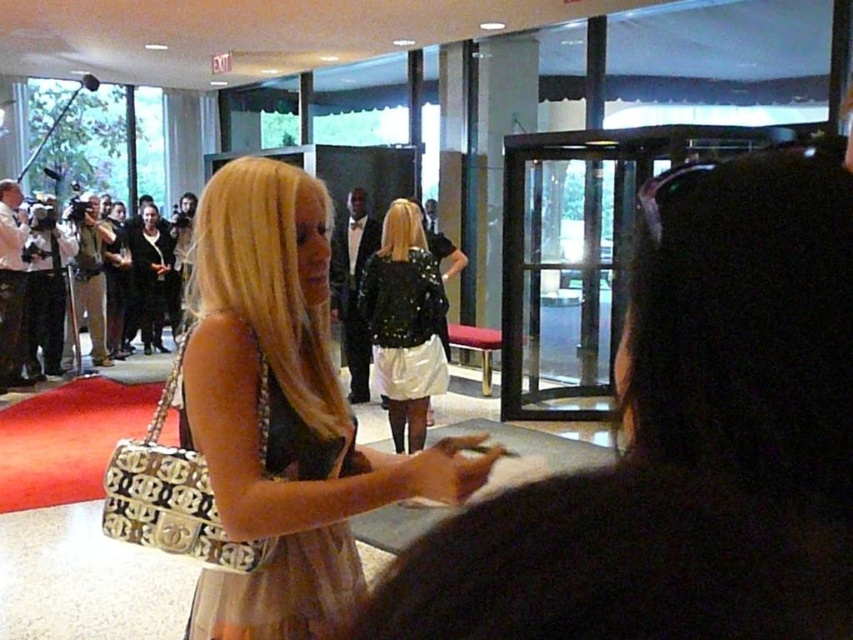
Question: Which point is closer to the camera?

Choices:
 (A) (230, 600)
 (B) (444, 548)

Answer: (B)

Question: Which of these objects is positioned farthest from the gold metallic purse at center?

Choices:
 (A) black satin dress at center
 (B) matte black dress at center
 (C) sequined black jacket at center

Answer: (C)

Question: Which of the following is the farthest from the observer?

Choices:
 (A) click(782, 205)
 (B) click(258, 376)

Answer: (B)

Question: Does black sequined jacket at center appear over sequined black jacket at center?

Choices:
 (A) no
 (B) yes

Answer: (B)

Question: From the image, what is the correct spatial relationship of gold metallic purse at center in relation to sequined black jacket at center?

Choices:
 (A) below
 (B) above

Answer: (A)

Question: In this image, where is matte black dress at center located relative to gold metallic purse at center?

Choices:
 (A) left
 (B) right

Answer: (B)